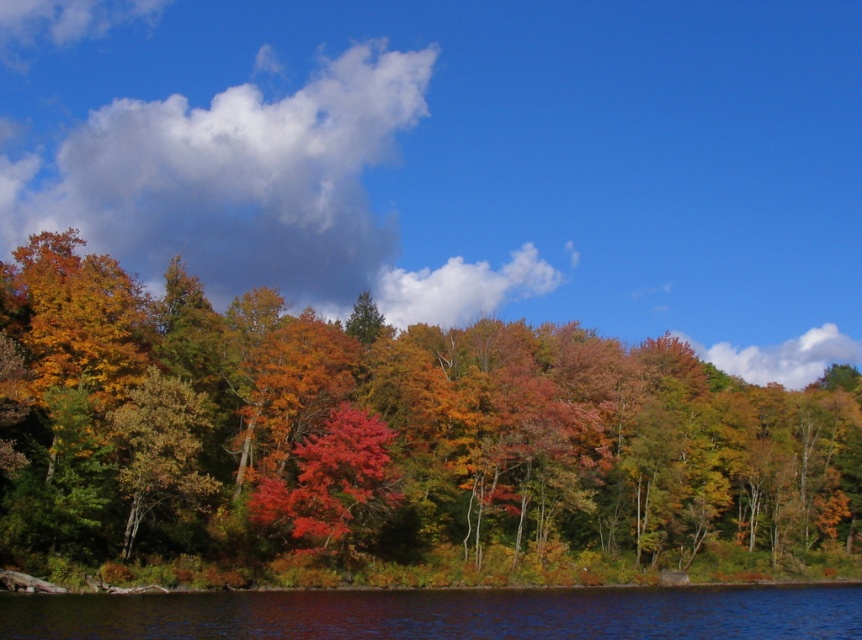
You are standing in the autumn landscape and looking at the clear blue sky. You notice a point marked at coordinates (259, 192). What is the object at that point?

The point at coordinates (259, 192) is located on a white fluffy cloud at upper left.

You are an airplane pilot preparing to fly over the autumn landscape. You notice two white fluffy clouds in the sky. Which cloud, the white fluffy cloud at upper left or the white fluffy cloud at upper center, is taller?

The white fluffy cloud at upper left is taller than the white fluffy cloud at upper center.

You are standing at the point marked by the coordinates point (445, 612). Looking around, you see the transparent blue water at lower center. Which direction should you walk to reach the trees with bright red leaves?

The point (445, 612) marks transparent blue water at lower center. Since the trees with bright red leaves are along the shoreline in the foreground, you should walk towards the upper part of the image to reach them.